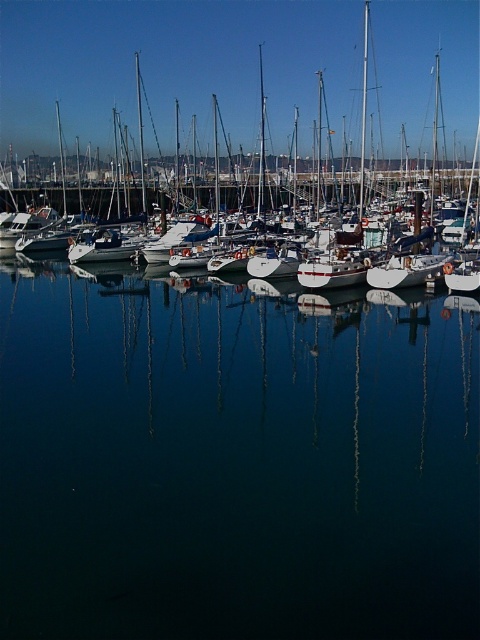
You are a photographer trying to capture the reflection of the white glossy sailboat at center in the dark blue water at center. Based on the scene, will the reflection be visible in the water?

The dark blue water at center is in front of the white glossy sailboat at center, so the reflection of the sailboat would be visible in the water since the water is calm and reflective as described in the scene.

You are a drone operator trying to capture a photo of the marina. The drone is currently at the bridge in the background. To ensure the dark blue water at center is in the frame, where should you position the drone relative to the water?

The dark blue water at center is located at coordinates point (233, 460), so position the drone to face that coordinate to include it in the frame.